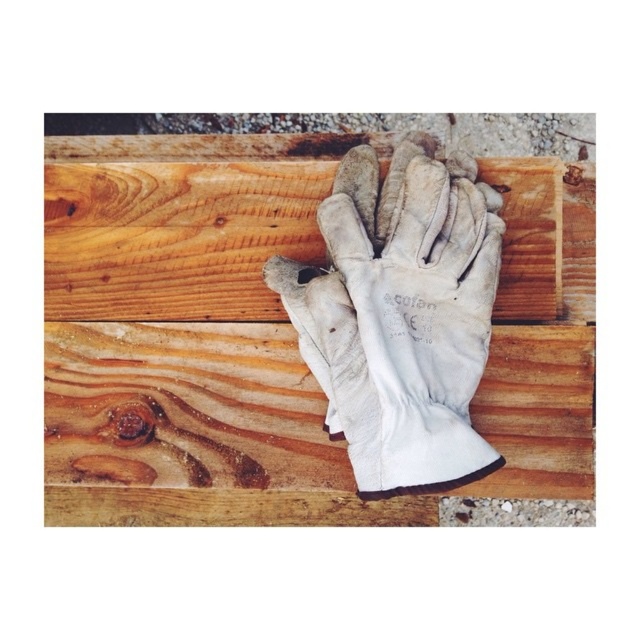
You are trying to place the white leather glove at center onto the wooden plank at center. Can the glove fit entirely on the plank without overhanging?

The white leather glove at center has a lesser width compared to wooden plank at center, so the glove can fit entirely on the plank without overhanging.

You are an inspector examining the scene. You notice a point at coordinates (x=401, y=314). What object is located at this point?

The point at coordinates (x=401, y=314) corresponds to the white leather glove at center.

You are a carpenter working on a project that requires precise measurements. You have a tool that needs to be placed on the wooden surface. Which object, the natural wood at center or the wooden plank at center, should you choose to ensure the tool remains stable due to its height?

The natural wood at center has a greater height compared to the wooden plank at center, so placing the tool on the natural wood at center would provide better stability due to its elevated surface.